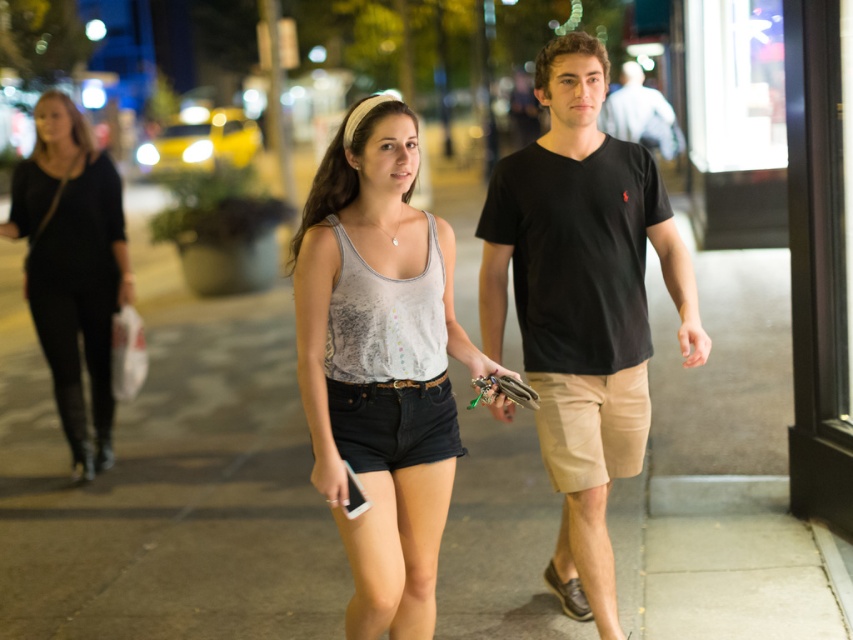
Between black cotton t-shirt at center and black leather pants at left, which one is positioned higher?

black leather pants at left is higher up.

Does black cotton t-shirt at center lie behind black leather pants at left?

No.

What do you see at coordinates (582, 300) in the screenshot? I see `black cotton t-shirt at center` at bounding box center [582, 300].

This screenshot has height=640, width=853. I want to click on black cotton t-shirt at center, so click(582, 300).

Is distressed white tank top at center taller than brown leather sandal at lower right?

Yes.

Measure the distance between point (370, 257) and camera.

A distance of 12.55 feet exists between point (370, 257) and camera.

Measure the distance between point (x=334, y=336) and camera.

Point (x=334, y=336) is 3.81 meters away from camera.

Locate an element on the screen. The image size is (853, 640). distressed white tank top at center is located at coordinates (380, 364).

Can you confirm if distressed white tank top at center is thinner than black leather pants at left?

Correct, distressed white tank top at center's width is less than black leather pants at left's.

Is point (332, 300) positioned behind point (59, 333)?

No, it is in front of (59, 333).

Locate an element on the screen. distressed white tank top at center is located at coordinates (380, 364).